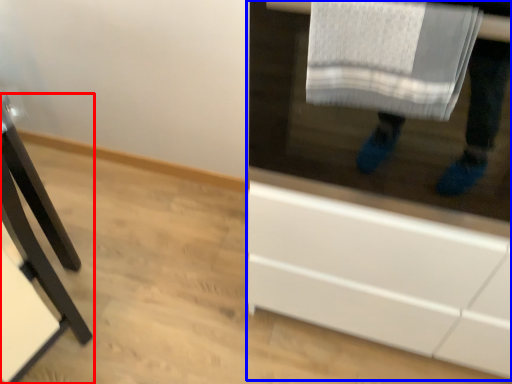
Question: Which object is closer to the camera taking this photo, furniture (highlighted by a red box) or cabinetry (highlighted by a blue box)?

Choices:
 (A) furniture
 (B) cabinetry

Answer: (B)